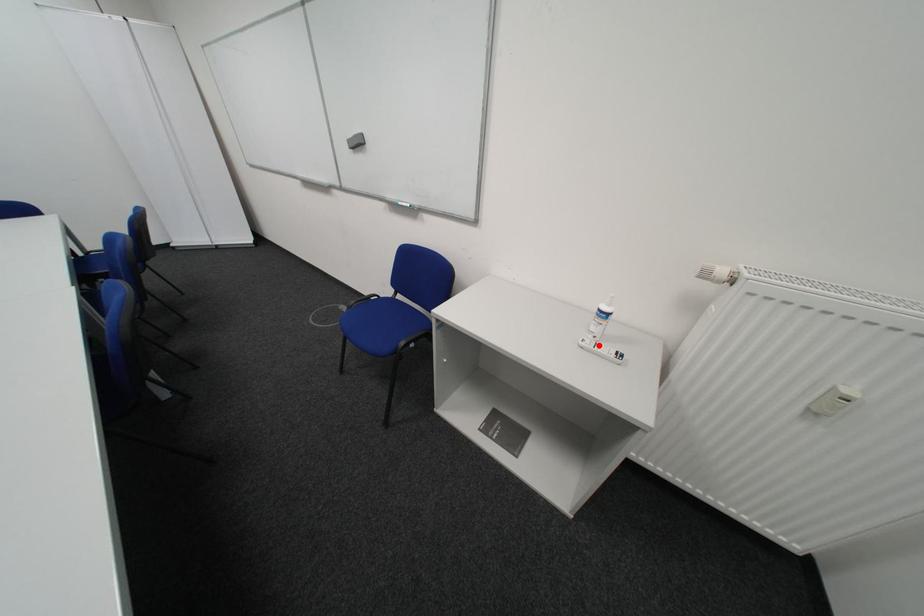
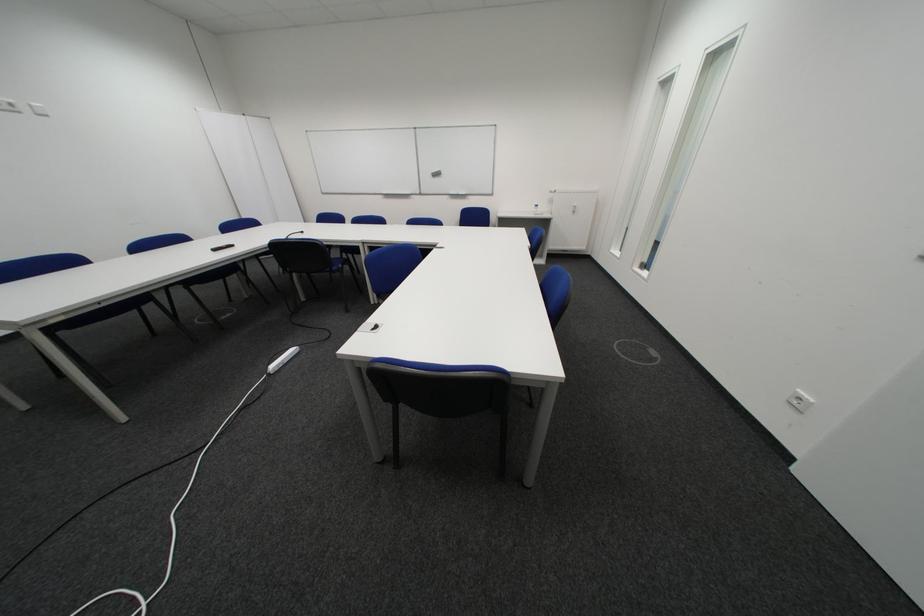
Where in the second image is the point corresponding to the highlighted location from the first image?

(548, 215)